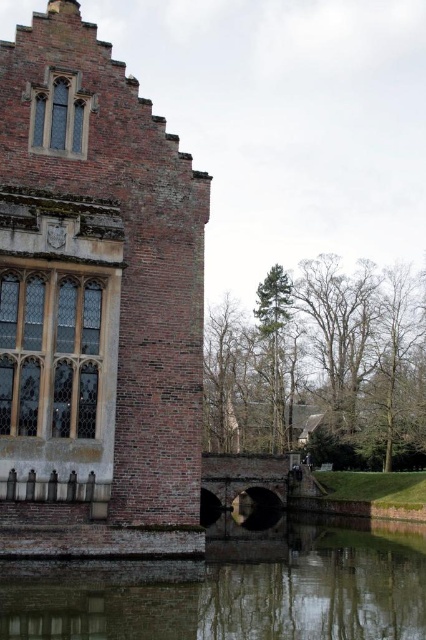
Question: Does brick wall at left have a greater width compared to smooth reflective water at lower center?

Choices:
 (A) no
 (B) yes

Answer: (A)

Question: Which of the following is the closest to the observer?

Choices:
 (A) smooth reflective water at lower center
 (B) brick wall at left

Answer: (A)

Question: Considering the relative positions of brick wall at left and smooth reflective water at lower center in the image provided, where is brick wall at left located with respect to smooth reflective water at lower center?

Choices:
 (A) right
 (B) left

Answer: (B)

Question: Which of the following is the closest to the observer?

Choices:
 (A) brick wall at left
 (B) smooth reflective water at lower center

Answer: (B)

Question: From the image, what is the correct spatial relationship of brick wall at left in relation to smooth reflective water at lower center?

Choices:
 (A) left
 (B) right

Answer: (A)